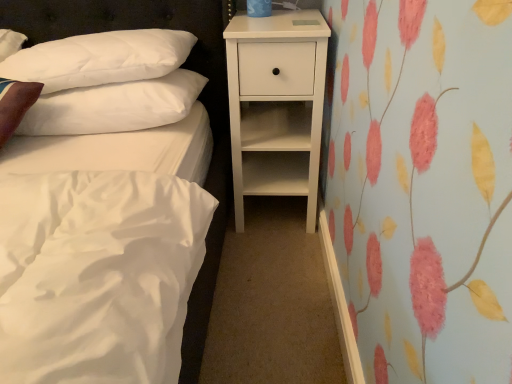
Image resolution: width=512 pixels, height=384 pixels. What do you see at coordinates (114, 106) in the screenshot?
I see `white soft pillow at upper left, which is the 2th pillow in top-to-bottom order` at bounding box center [114, 106].

What is the approximate width of white soft pillow at upper left, acting as the 1th pillow starting from the top?

It is 40.42 centimeters.

The height and width of the screenshot is (384, 512). What are the coordinates of `white matte nightstand at center` in the screenshot? It's located at (276, 105).

Where is `white soft pillow at upper left, positioned as the first pillow in bottom-to-top order`? The width and height of the screenshot is (512, 384). white soft pillow at upper left, positioned as the first pillow in bottom-to-top order is located at coordinates (114, 106).

From the picture: How different are the orientations of white soft pillow at upper left, which is the 2th pillow in top-to-bottom order, and white soft pillow at upper left, acting as the 1th pillow starting from the top, in degrees?

There is a 0.494-degree angle between the facing directions of white soft pillow at upper left, which is the 2th pillow in top-to-bottom order, and white soft pillow at upper left, acting as the 1th pillow starting from the top.

Is white soft pillow at upper left, positioned as the first pillow in bottom-to-top order, oriented towards white soft pillow at upper left, acting as the 1th pillow starting from the top?

No, white soft pillow at upper left, positioned as the first pillow in bottom-to-top order, is not aimed at white soft pillow at upper left, acting as the 1th pillow starting from the top.

From the image's perspective, is white soft pillow at upper left, which is the 2th pillow in top-to-bottom order, located above or below white soft pillow at upper left, acting as the 1th pillow starting from the top?

From the image's perspective, white soft pillow at upper left, which is the 2th pillow in top-to-bottom order, appears below white soft pillow at upper left, acting as the 1th pillow starting from the top.

Are white soft pillow at upper left, positioned as the first pillow in bottom-to-top order, and white soft pillow at upper left, marked as the second pillow in a bottom-to-top arrangement, beside each other?

Yes, white soft pillow at upper left, positioned as the first pillow in bottom-to-top order, is beside white soft pillow at upper left, marked as the second pillow in a bottom-to-top arrangement.

Is white soft pillow at upper left, marked as the second pillow in a bottom-to-top arrangement, outside of white soft pillow at upper left, positioned as the first pillow in bottom-to-top order?

Yes.

Does white soft pillow at upper left, marked as the second pillow in a bottom-to-top arrangement, have a greater width compared to white soft pillow at upper left, which is the 2th pillow in top-to-bottom order?

No.

Is white soft pillow at upper left, marked as the second pillow in a bottom-to-top arrangement, further to the viewer compared to white soft pillow at upper left, positioned as the first pillow in bottom-to-top order?

No, it is not.

Considering the points (41, 123) and (306, 156), which point is in front, point (41, 123) or point (306, 156)?

Positioned in front is point (41, 123).

Could you measure the distance between white soft pillow at upper left, which is the 2th pillow in top-to-bottom order, and white matte nightstand at center?

39.19 centimeters.

Is white soft pillow at upper left, which is the 2th pillow in top-to-bottom order, wider than white matte nightstand at center?

Incorrect, the width of white soft pillow at upper left, which is the 2th pillow in top-to-bottom order, does not surpass that of white matte nightstand at center.

From a real-world perspective, is white soft pillow at upper left, positioned as the first pillow in bottom-to-top order, under white matte nightstand at center?

Actually, white soft pillow at upper left, positioned as the first pillow in bottom-to-top order, is physically above white matte nightstand at center in the real world.

Which point is more distant from viewer, (292,164) or (76,64)?

The point (292,164) is farther.

Considering the relative positions of white matte nightstand at center and white soft pillow at upper left, acting as the 1th pillow starting from the top, in the image provided, is white matte nightstand at center to the left or to the right of white soft pillow at upper left, acting as the 1th pillow starting from the top,?

Clearly, white matte nightstand at center is on the right of white soft pillow at upper left, acting as the 1th pillow starting from the top, in the image.

Consider the image. Can you confirm if white matte nightstand at center is bigger than white soft pillow at upper left, acting as the 1th pillow starting from the top?

Correct, white matte nightstand at center is larger in size than white soft pillow at upper left, acting as the 1th pillow starting from the top.

From the image's perspective, is white matte nightstand at center below white soft pillow at upper left, marked as the second pillow in a bottom-to-top arrangement?

Yes, from the image's perspective, white matte nightstand at center is below white soft pillow at upper left, marked as the second pillow in a bottom-to-top arrangement.

From a real-world perspective, between white soft pillow at upper left, acting as the 1th pillow starting from the top, and white matte nightstand at center, who is vertically lower?

In real-world perspective, white matte nightstand at center is lower.

Could you tell me if white soft pillow at upper left, acting as the 1th pillow starting from the top, is facing white matte nightstand at center?

No, white soft pillow at upper left, acting as the 1th pillow starting from the top, does not turn towards white matte nightstand at center.

From the picture: Which object is positioned more to the right, white soft pillow at upper left, marked as the second pillow in a bottom-to-top arrangement, or white matte nightstand at center?

white matte nightstand at center is more to the right.

Is white soft pillow at upper left, marked as the second pillow in a bottom-to-top arrangement, outside of white matte nightstand at center?

Yes.

From the image's perspective, which one is positioned lower, white matte nightstand at center or white soft pillow at upper left, positioned as the first pillow in bottom-to-top order?

white matte nightstand at center, from the image's perspective.

Can you tell me how much white matte nightstand at center and white soft pillow at upper left, positioned as the first pillow in bottom-to-top order, differ in facing direction?

4.09 degrees.

Which is in front, point (288, 17) or point (161, 99)?

Positioned in front is point (161, 99).

Could you tell me if white matte nightstand at center is facing white soft pillow at upper left, which is the 2th pillow in top-to-bottom order?

No, white matte nightstand at center is not turned towards white soft pillow at upper left, which is the 2th pillow in top-to-bottom order.

Locate an element on the screen. The image size is (512, 384). pillow on the left of white soft pillow at upper left, positioned as the first pillow in bottom-to-top order is located at coordinates (100, 58).

You are a GUI agent. You are given a task and a screenshot of the screen. Output one action in this format:
    pyautogui.click(x=<x>, y=<y>)
    Task: Click on the pillow below the white soft pillow at upper left, marked as the second pillow in a bottom-to-top arrangement (from the image's perspective)
    
    Given the screenshot: What is the action you would take?
    pyautogui.click(x=114, y=106)

Looking at the image, which one is located closer to white matte nightstand at center, white soft pillow at upper left, positioned as the first pillow in bottom-to-top order, or white soft pillow at upper left, acting as the 1th pillow starting from the top?

white soft pillow at upper left, positioned as the first pillow in bottom-to-top order, is closer to white matte nightstand at center.

Looking at this image, when comparing their distances from white soft pillow at upper left, which is the 2th pillow in top-to-bottom order, does white soft pillow at upper left, marked as the second pillow in a bottom-to-top arrangement, or white matte nightstand at center seem closer?

The object closer to white soft pillow at upper left, which is the 2th pillow in top-to-bottom order, is white soft pillow at upper left, marked as the second pillow in a bottom-to-top arrangement.

Looking at the image, which one is located further to white soft pillow at upper left, marked as the second pillow in a bottom-to-top arrangement, white soft pillow at upper left, positioned as the first pillow in bottom-to-top order, or white matte nightstand at center?

white matte nightstand at center.

From the image, which object appears to be farther from white soft pillow at upper left, which is the 2th pillow in top-to-bottom order, white matte nightstand at center or white soft pillow at upper left, acting as the 1th pillow starting from the top?

Based on the image, white matte nightstand at center appears to be further to white soft pillow at upper left, which is the 2th pillow in top-to-bottom order.

Consider the image. When comparing their distances from white matte nightstand at center, does white soft pillow at upper left, acting as the 1th pillow starting from the top, or white soft pillow at upper left, positioned as the first pillow in bottom-to-top order, seem further?

white soft pillow at upper left, acting as the 1th pillow starting from the top.

Looking at this image, when comparing their distances from white soft pillow at upper left, acting as the 1th pillow starting from the top, does white matte nightstand at center or white soft pillow at upper left, positioned as the first pillow in bottom-to-top order, seem further?

white matte nightstand at center is positioned further to the anchor white soft pillow at upper left, acting as the 1th pillow starting from the top.

The image size is (512, 384). Find the location of `pillow between white soft pillow at upper left, marked as the second pillow in a bottom-to-top arrangement, and white matte nightstand at center, in the horizontal direction`. pillow between white soft pillow at upper left, marked as the second pillow in a bottom-to-top arrangement, and white matte nightstand at center, in the horizontal direction is located at coordinates (114, 106).